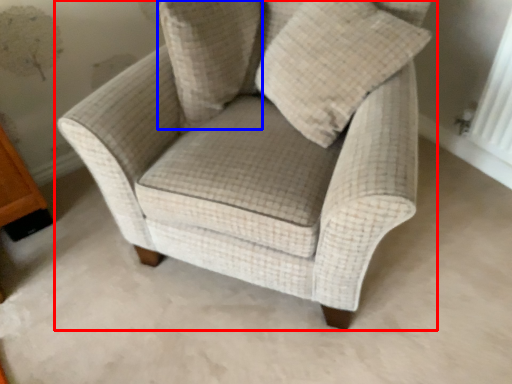
Question: Among these objects, which one is nearest to the camera, chair (highlighted by a red box) or pillow (highlighted by a blue box)?

Choices:
 (A) chair
 (B) pillow

Answer: (A)